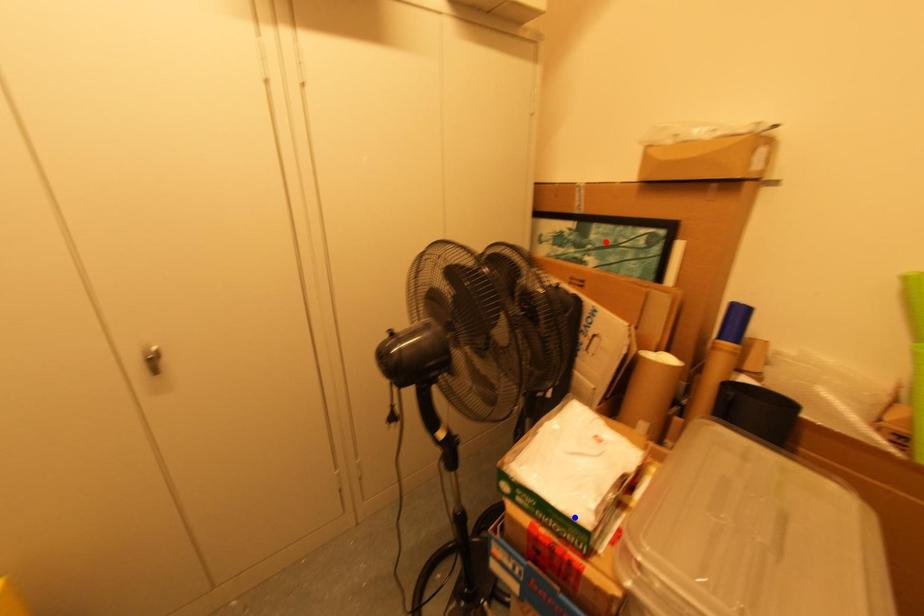
Question: Which of the two points in the image is closer to the camera?

Choices:
 (A) Blue point is closer.
 (B) Red point is closer.

Answer: (A)